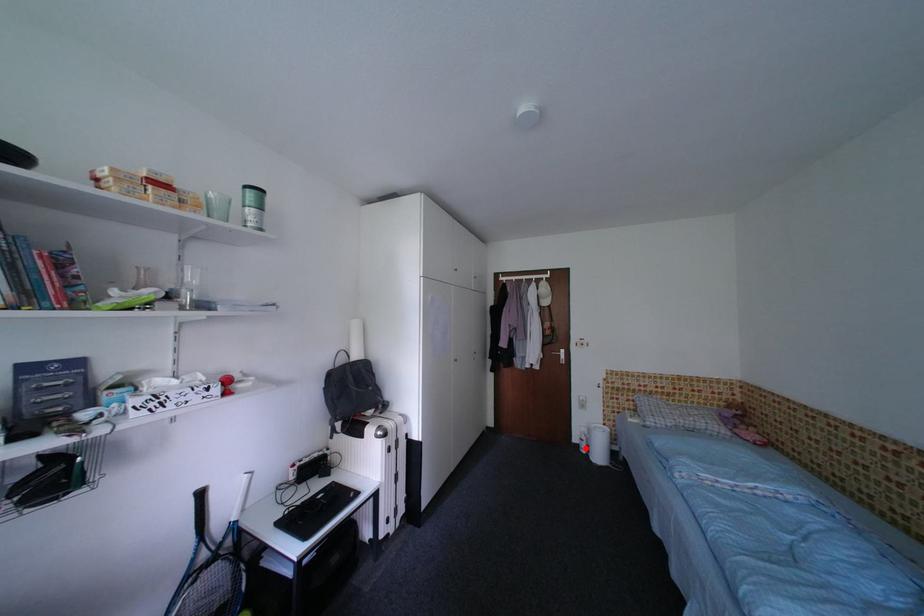
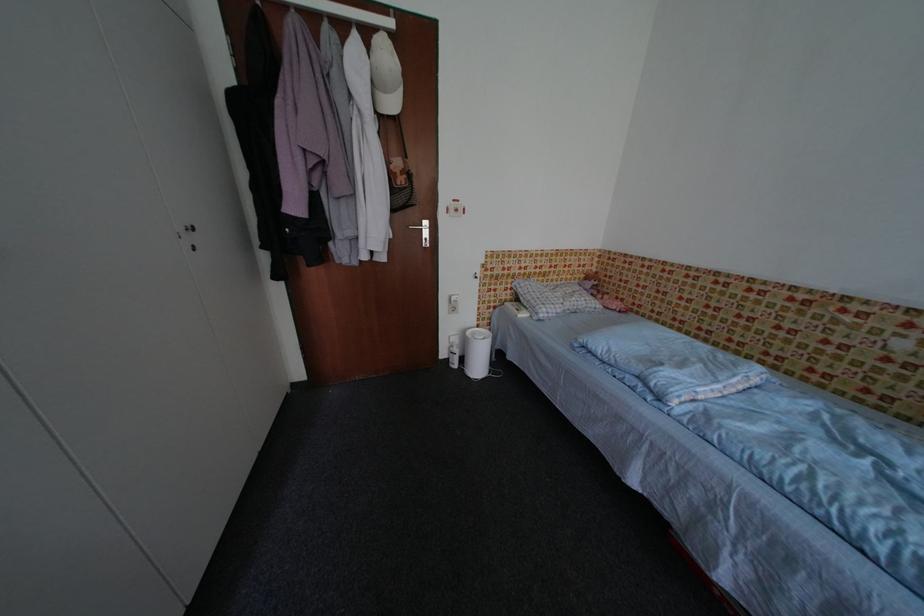
Question: I am providing you with two images of the same scene from different viewpoints. Image1 has a red point marked. In image2, the corresponding 3D location appears at what relative position? Reply with the corresponding letter.

Choices:
 (A) Closer
 (B) Farther

Answer: (B)